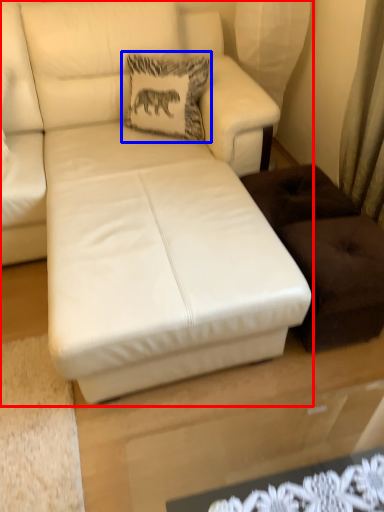
Question: Which point is further to the camera, studio couch (highlighted by a red box) or pillow (highlighted by a blue box)?

Choices:
 (A) studio couch
 (B) pillow

Answer: (B)